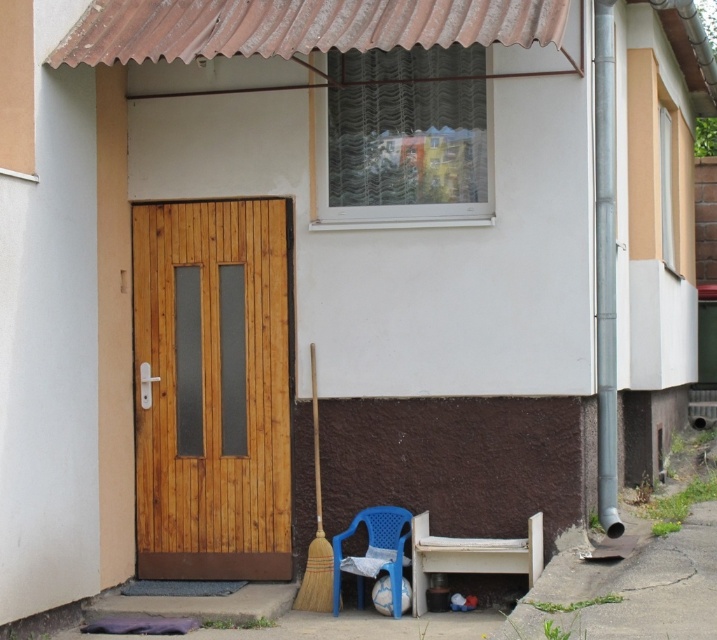
Is natural wood door at center above blue plastic chair at lower center?

Indeed, natural wood door at center is positioned over blue plastic chair at lower center.

Which is below, natural wood door at center or blue plastic chair at lower center?

blue plastic chair at lower center is lower down.

Between point (237, 250) and point (397, 595), which one is positioned behind?

Point (237, 250)

The height and width of the screenshot is (640, 717). Identify the location of natural wood door at center. (212, 390).

Can you confirm if natural wood door at center is shorter than white matte bench at lower right?

No, natural wood door at center is not shorter than white matte bench at lower right.

Is natural wood door at center positioned before white matte bench at lower right?

No, natural wood door at center is further to the viewer.

You are a GUI agent. You are given a task and a screenshot of the screen. Output one action in this format:
    pyautogui.click(x=<x>, y=<y>)
    Task: Click on the natural wood door at center
    The height and width of the screenshot is (640, 717).
    Given the screenshot: What is the action you would take?
    pyautogui.click(x=212, y=390)

What do you see at coordinates (470, 556) in the screenshot? I see `white matte bench at lower right` at bounding box center [470, 556].

What do you see at coordinates (470, 556) in the screenshot? The width and height of the screenshot is (717, 640). I see `white matte bench at lower right` at bounding box center [470, 556].

You are a GUI agent. You are given a task and a screenshot of the screen. Output one action in this format:
    pyautogui.click(x=<x>, y=<y>)
    Task: Click on the white matte bench at lower right
    The height and width of the screenshot is (640, 717).
    Given the screenshot: What is the action you would take?
    pyautogui.click(x=470, y=556)